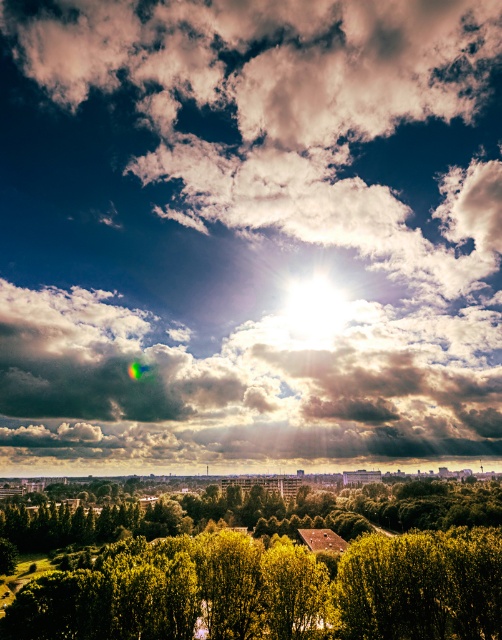
Question: Is bright white clouds at upper center smaller than green leafy tree at center?

Choices:
 (A) yes
 (B) no

Answer: (B)

Question: Does bright white clouds at upper center appear over green leafy tree at center?

Choices:
 (A) yes
 (B) no

Answer: (A)

Question: Among these points, which one is farthest from the camera?

Choices:
 (A) (260, 582)
 (B) (382, 449)

Answer: (B)

Question: Is the position of bright white clouds at upper center less distant than that of green leafy tree at center?

Choices:
 (A) no
 (B) yes

Answer: (A)